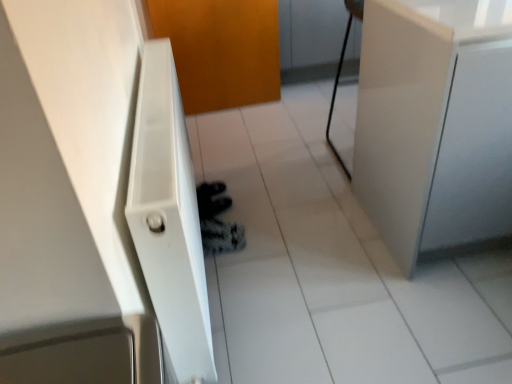
You are a GUI agent. You are given a task and a screenshot of the screen. Output one action in this format:
    pyautogui.click(x=<x>, y=<y>)
    Task: Click on the white glossy cabinet at right
    
    Given the screenshot: What is the action you would take?
    pyautogui.click(x=435, y=123)

Is white textured radiator at left touching white glossy cabinet at right?

There is a gap between white textured radiator at left and white glossy cabinet at right.

Is white textured radiator at left taller or shorter than white glossy cabinet at right?

Clearly, white textured radiator at left is shorter compared to white glossy cabinet at right.

This screenshot has height=384, width=512. In order to click on cabinetry above the white textured radiator at left (from the image's perspective) in this screenshot , I will do `click(435, 123)`.

How different are the orientations of white textured radiator at left and white glossy cabinet at right in degrees?

They differ by 88.9 degrees in their facing directions.

Is white textured radiator at left beside white glossy tile at center?

No, white textured radiator at left is not touching white glossy tile at center.

From a real-world perspective, is white textured radiator at left positioned under white glossy tile at center based on gravity?

Actually, white textured radiator at left is physically above white glossy tile at center in the real world.

Is white textured radiator at left facing towards white glossy tile at center?

Yes, white textured radiator at left is turned towards white glossy tile at center.

From the image's perspective, is white textured radiator at left above or below white glossy tile at center?

white textured radiator at left is situated lower than white glossy tile at center in the image.

Considering the relative positions of white textured radiator at left and orange matte door at center in the image provided, is white textured radiator at left in front of orange matte door at center?

Yes, it is.

Can we say white textured radiator at left lies outside orange matte door at center?

Yes.

From a real-world perspective, is white textured radiator at left physically located above or below orange matte door at center?

white textured radiator at left is situated higher than orange matte door at center in the real world.

Which of these two, white textured radiator at left or orange matte door at center, is wider?

white textured radiator at left is wider.

From the image's perspective, would you say white glossy cabinet at right is shown under white textured radiator at left?

No.

Between white glossy cabinet at right and white textured radiator at left, which one has smaller width?

white textured radiator at left is thinner.

How different are the orientations of white glossy cabinet at right and white textured radiator at left in degrees?

white glossy cabinet at right and white textured radiator at left are facing 88.9 degrees away from each other.

Is white glossy cabinet at right oriented away from white textured radiator at left?

No, white textured radiator at left is not at the back of white glossy cabinet at right.

From the image's perspective, is white glossy cabinet at right under white glossy tile at center?

Actually, white glossy cabinet at right appears above white glossy tile at center in the image.

From the picture: Is white glossy cabinet at right placed right next to white glossy tile at center?

white glossy cabinet at right and white glossy tile at center are not in contact.

Considering the positions of point (365, 43) and point (326, 371), is point (365, 43) closer or farther from the camera than point (326, 371)?

Point (365, 43) is positioned farther from the camera compared to point (326, 371).

Is white glossy cabinet at right further to camera compared to white glossy tile at center?

No, white glossy cabinet at right is in front of white glossy tile at center.

Consider the image. How many degrees apart are the facing directions of white glossy cabinet at right and orange matte door at center?

There is a 5.08-degree angle between the facing directions of white glossy cabinet at right and orange matte door at center.

Considering the sizes of objects white glossy cabinet at right and orange matte door at center in the image provided, who is shorter, white glossy cabinet at right or orange matte door at center?

Standing shorter between the two is orange matte door at center.

Which is more to the left, white glossy cabinet at right or orange matte door at center?

Positioned to the left is orange matte door at center.

Is white glossy cabinet at right looking in the opposite direction of orange matte door at center?

No, white glossy cabinet at right is not facing away from orange matte door at center.

Considering the relative positions of orange matte door at center and white glossy tile at center in the image provided, is orange matte door at center to the left or to the right of white glossy tile at center?

Clearly, orange matte door at center is on the left of white glossy tile at center in the image.

How much distance is there between orange matte door at center and white glossy tile at center?

orange matte door at center is 1.09 meters from white glossy tile at center.

Is orange matte door at center closer to the viewer compared to white glossy tile at center?

No, the depth of orange matte door at center is greater than that of white glossy tile at center.

I want to click on radiator in front of the white glossy cabinet at right, so (169, 218).

At what (x,y) coordinates should I click in order to perform the action: click on tile located underneath the white textured radiator at left (from a real-world perspective). Please return your answer as a coordinate pair (x, y). Image resolution: width=512 pixels, height=384 pixels. Looking at the image, I should click on (333, 270).

Estimate the real-world distances between objects in this image. Which object is closer to orange matte door at center, white glossy cabinet at right or white textured radiator at left?

Based on the image, white textured radiator at left appears to be nearer to orange matte door at center.

Which object lies nearer to the anchor point white textured radiator at left, white glossy cabinet at right or orange matte door at center?

The object closer to white textured radiator at left is white glossy cabinet at right.

Looking at the image, which one is located closer to white glossy tile at center, orange matte door at center or white textured radiator at left?

white textured radiator at left is positioned closer to the anchor white glossy tile at center.

Which object lies nearer to the anchor point white glossy cabinet at right, orange matte door at center or white textured radiator at left?

Based on the image, white textured radiator at left appears to be nearer to white glossy cabinet at right.

When comparing their distances from orange matte door at center, does white glossy tile at center or white textured radiator at left seem further?

white textured radiator at left is further to orange matte door at center.

Based on their spatial positions, is white glossy tile at center or white textured radiator at left closer to white glossy cabinet at right?

white glossy tile at center.

When comparing their distances from white glossy tile at center, does white textured radiator at left or white glossy cabinet at right seem further?

The object further to white glossy tile at center is white textured radiator at left.

Looking at the image, which one is located closer to white textured radiator at left, white glossy tile at center or white glossy cabinet at right?

white glossy tile at center is positioned closer to the anchor white textured radiator at left.

You are a GUI agent. You are given a task and a screenshot of the screen. Output one action in this format:
    pyautogui.click(x=<x>, y=<y>)
    Task: Click on the tile between white glossy cabinet at right and orange matte door at center in the front-back direction
    This screenshot has width=512, height=384.
    Given the screenshot: What is the action you would take?
    pyautogui.click(x=333, y=270)

Locate an element on the screen. The image size is (512, 384). cabinetry between white textured radiator at left and orange matte door at center in the front-back direction is located at coordinates (435, 123).

Identify the location of tile located between white textured radiator at left and white glossy cabinet at right in the left-right direction. (333, 270).

Where is `tile between white textured radiator at left and orange matte door at center from front to back`? The image size is (512, 384). tile between white textured radiator at left and orange matte door at center from front to back is located at coordinates (333, 270).